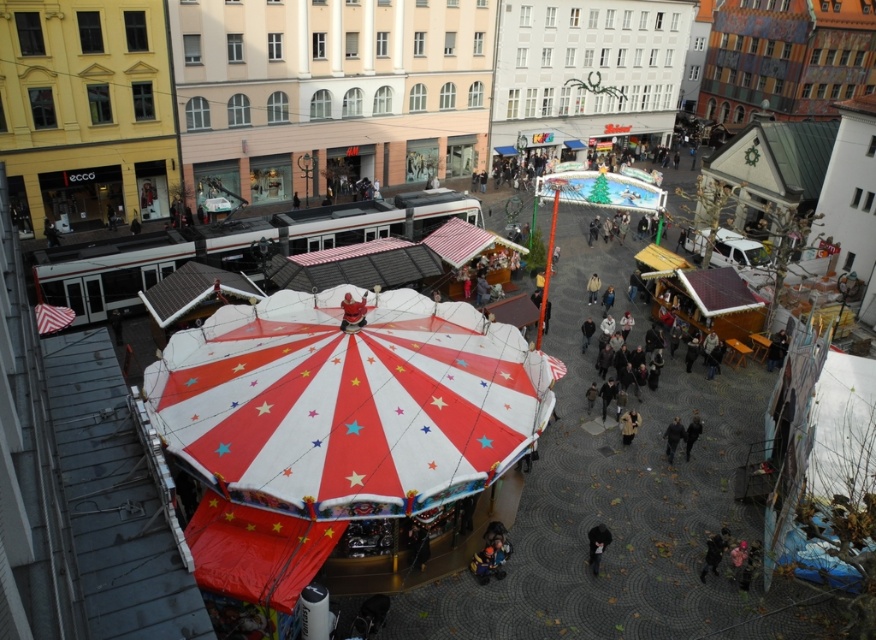
Question: From the image, what is the correct spatial relationship of red and white striped umbrella at center in relation to matte red coat at center?

Choices:
 (A) right
 (B) left

Answer: (A)

Question: Is red and white striped umbrella at center positioned in front of dark gray coat at center?

Choices:
 (A) no
 (B) yes

Answer: (B)

Question: Which of the following is the farthest from the observer?

Choices:
 (A) dark gray jacket at center
 (B) red and white striped umbrella at center
 (C) dark gray coat at center

Answer: (A)

Question: Which point appears farthest from the camera in this image?

Choices:
 (A) (606, 538)
 (B) (364, 300)
 (C) (384, 417)

Answer: (B)

Question: Which object is closer to the camera taking this photo?

Choices:
 (A) dark gray jacket at center
 (B) dark gray coat at center

Answer: (B)

Question: Where is matte red coat at center located in relation to dark gray coat at center in the image?

Choices:
 (A) above
 (B) below

Answer: (A)